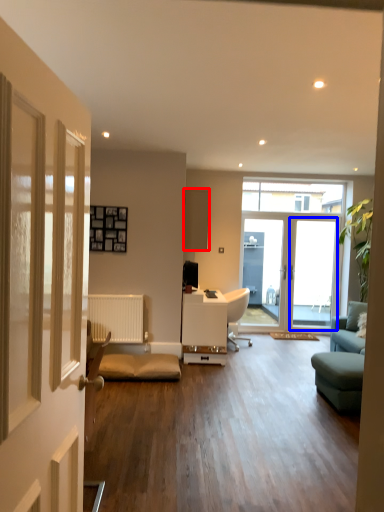
Question: Which object appears farthest to the camera in this image, cabinetry (highlighted by a red box) or screen door (highlighted by a blue box)?

Choices:
 (A) cabinetry
 (B) screen door

Answer: (B)